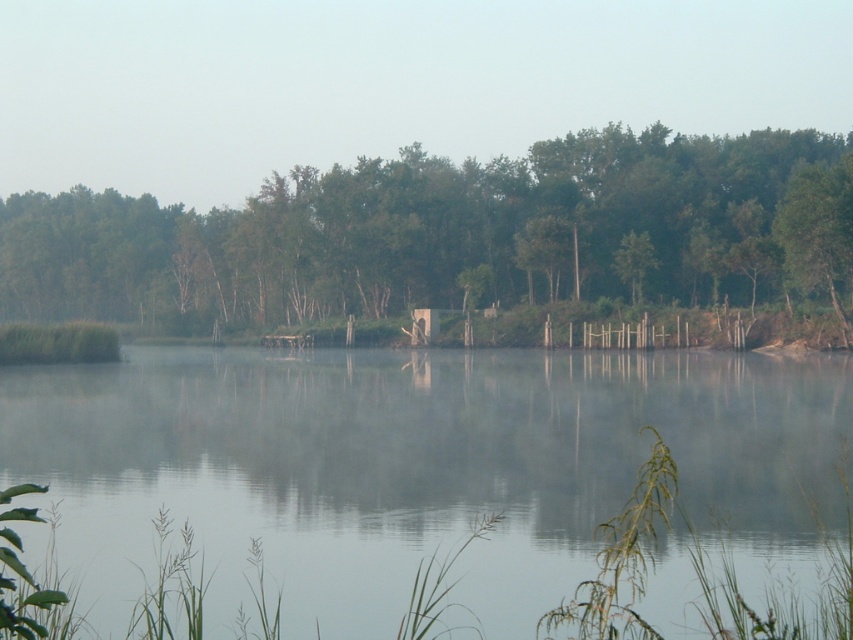
Between transparent water at center and green matte tree at center, which one has less height?

With less height is transparent water at center.

The height and width of the screenshot is (640, 853). What are the coordinates of `transparent water at center` in the screenshot? It's located at (419, 468).